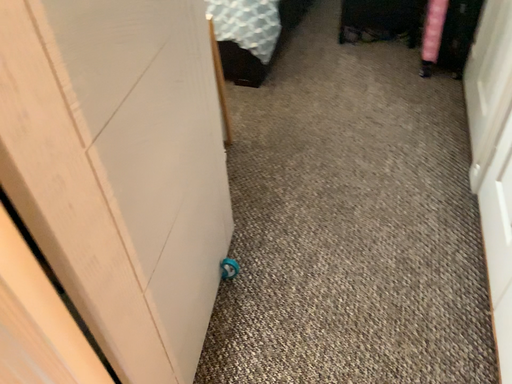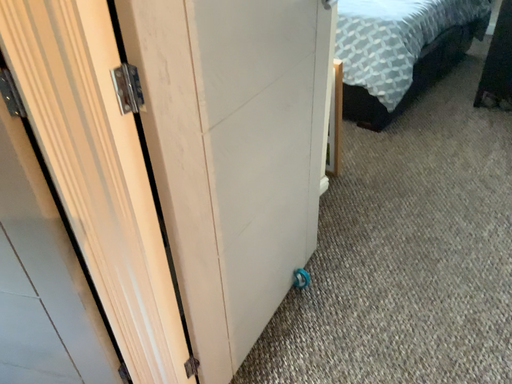
Question: How did the camera likely rotate when shooting the video?

Choices:
 (A) rotated left
 (B) rotated right

Answer: (A)